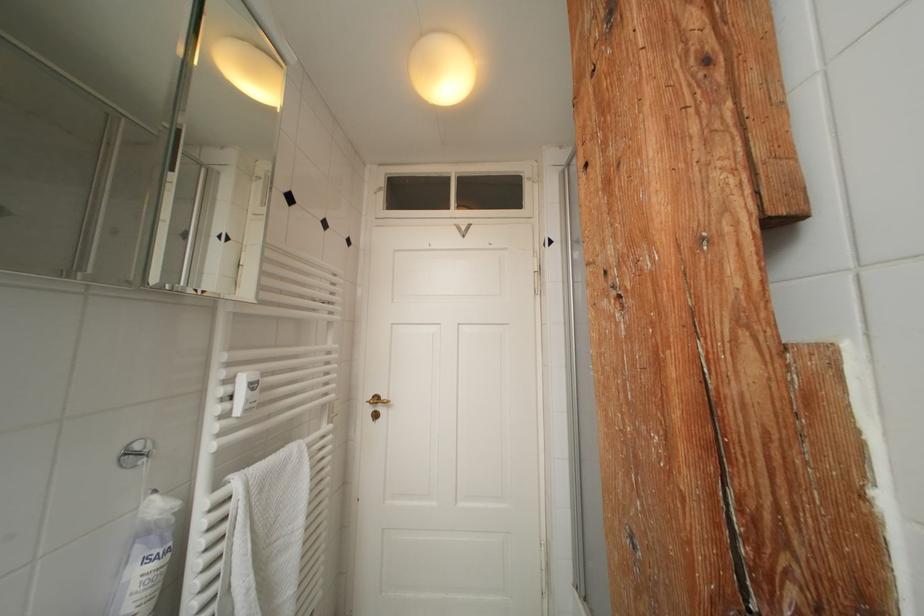
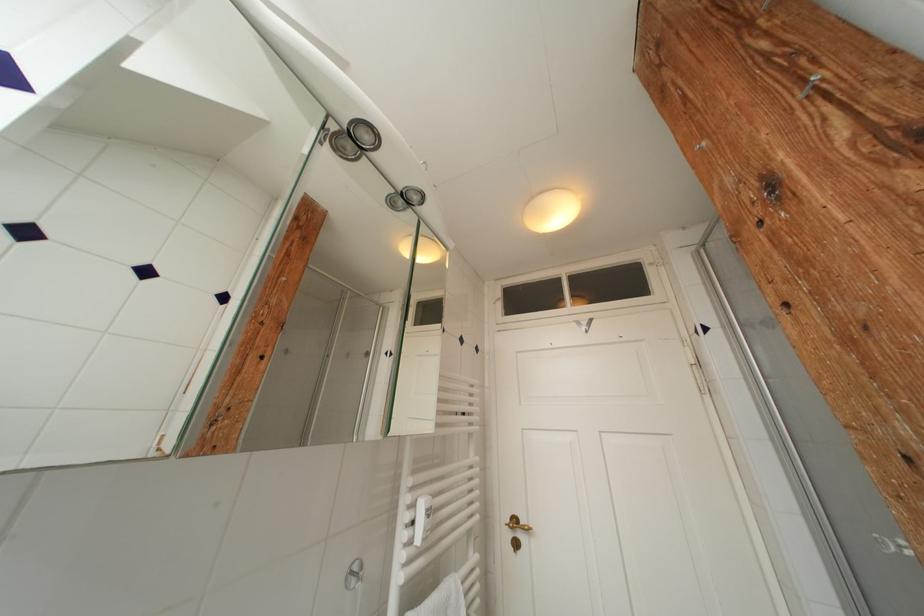
In the second image, find the point that corresponds to the point at 377,411 in the first image.

(516, 539)